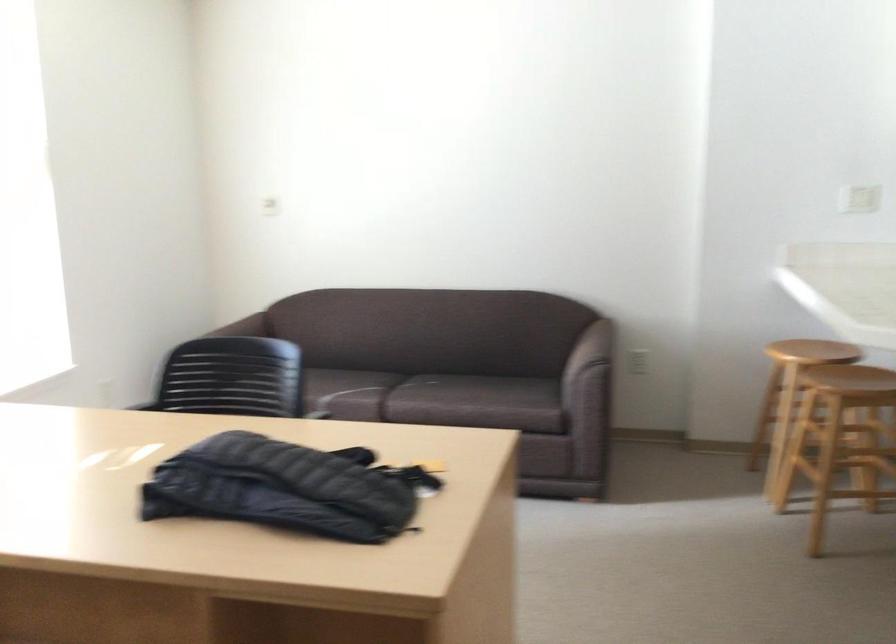
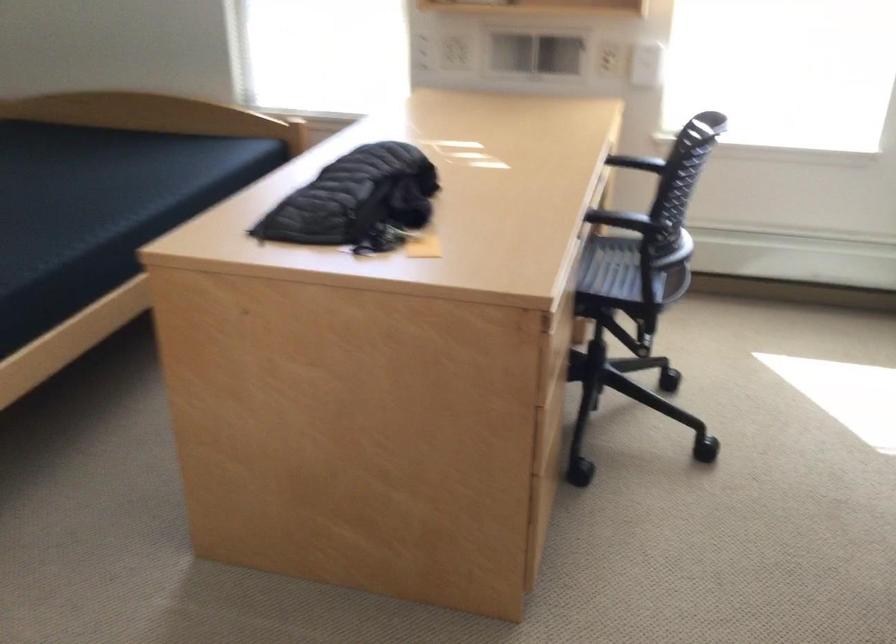
Find the pixel in the second image that matches point 300,430 in the first image.

(597, 216)